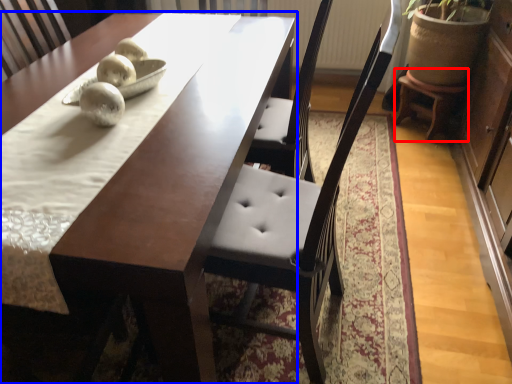
Question: Which of the following is the farthest to the observer, stool (highlighted by a red box) or table (highlighted by a blue box)?

Choices:
 (A) stool
 (B) table

Answer: (A)